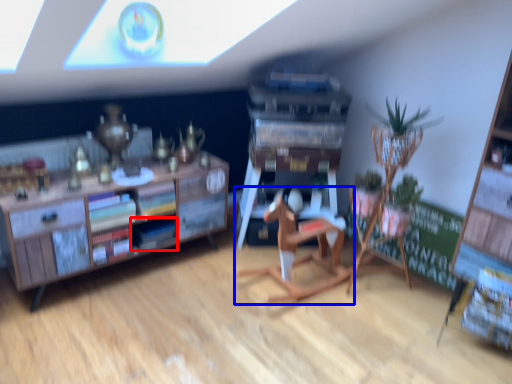
Question: Which point is further to the camera, book (highlighted by a red box) or chair (highlighted by a blue box)?

Choices:
 (A) book
 (B) chair

Answer: (A)